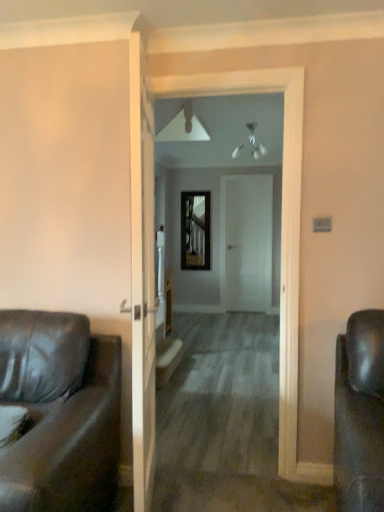
Question: Considering the relative sizes of white matte door at center and smooth wooden floor at center in the image provided, is white matte door at center thinner than smooth wooden floor at center?

Choices:
 (A) no
 (B) yes

Answer: (A)

Question: Does white matte door at center have a greater width compared to smooth wooden floor at center?

Choices:
 (A) no
 (B) yes

Answer: (B)

Question: Does white matte door at center contain smooth wooden floor at center?

Choices:
 (A) yes
 (B) no

Answer: (B)

Question: Is white matte door at center positioned in front of smooth wooden floor at center?

Choices:
 (A) yes
 (B) no

Answer: (B)

Question: Is white matte door at center at the right side of smooth wooden floor at center?

Choices:
 (A) no
 (B) yes

Answer: (B)

Question: Is white matte door at center spatially inside matte black leather couch at left, or outside of it?

Choices:
 (A) inside
 (B) outside

Answer: (B)

Question: Considering the positions of white matte door at center and matte black leather couch at left in the image, is white matte door at center wider or thinner than matte black leather couch at left?

Choices:
 (A) wide
 (B) thin

Answer: (B)

Question: Considering the positions of white matte door at center and matte black leather couch at left in the image, is white matte door at center bigger or smaller than matte black leather couch at left?

Choices:
 (A) small
 (B) big

Answer: (A)

Question: From the image's perspective, relative to matte black leather couch at left, is white matte door at center above or below?

Choices:
 (A) above
 (B) below

Answer: (A)

Question: Considering their positions, is white matte door at center located in front of or behind metallic reflective mirror at center?

Choices:
 (A) front
 (B) behind

Answer: (A)

Question: Which is correct: white matte door at center is inside metallic reflective mirror at center, or outside of it?

Choices:
 (A) inside
 (B) outside

Answer: (B)

Question: Considering the positions of white matte door at center and metallic reflective mirror at center in the image, is white matte door at center taller or shorter than metallic reflective mirror at center?

Choices:
 (A) short
 (B) tall

Answer: (B)

Question: Is point (269, 232) positioned closer to the camera than point (188, 216)?

Choices:
 (A) farther
 (B) closer

Answer: (B)

Question: Is white matte door at center wider or thinner than smooth wooden floor at center?

Choices:
 (A) wide
 (B) thin

Answer: (A)

Question: Do you think white matte door at center is within smooth wooden floor at center, or outside of it?

Choices:
 (A) outside
 (B) inside

Answer: (A)